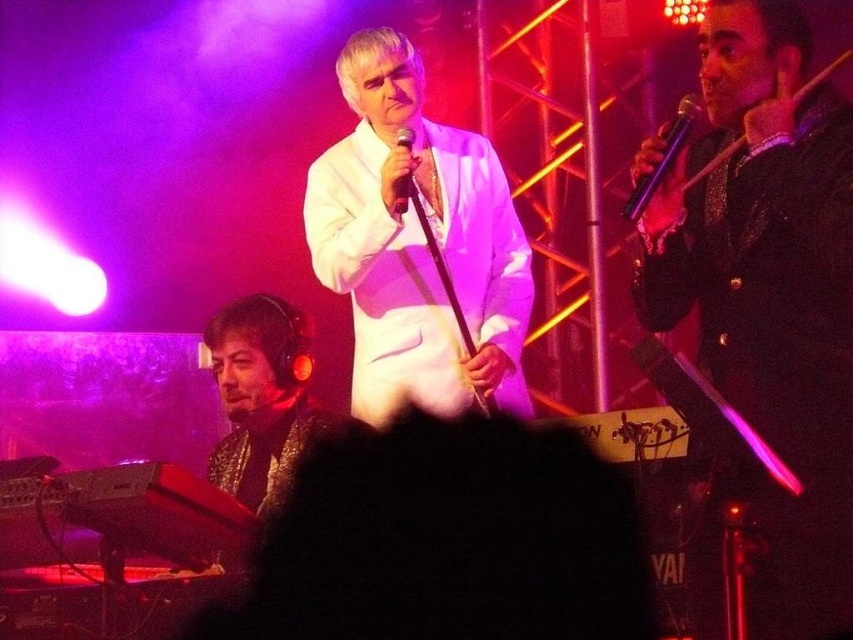
Question: Is white satin suit at center further to camera compared to black matte microphone at center?

Choices:
 (A) yes
 (B) no

Answer: (A)

Question: Which point is farther to the camera?

Choices:
 (A) (364, 269)
 (B) (675, 129)

Answer: (A)

Question: Among these points, which one is farthest from the camera?

Choices:
 (A) (402, 198)
 (B) (775, 228)
 (C) (635, 188)
 (D) (523, 284)

Answer: (D)

Question: Among these objects, which one is nearest to the camera?

Choices:
 (A) white satin suit at center
 (B) purple metallic microphone at upper right

Answer: (B)

Question: Does shiny black jacket at center appear over purple metallic microphone at upper right?

Choices:
 (A) no
 (B) yes

Answer: (A)

Question: From the image, what is the correct spatial relationship of shiny black jacket at center in relation to black matte microphone at center?

Choices:
 (A) below
 (B) above

Answer: (A)